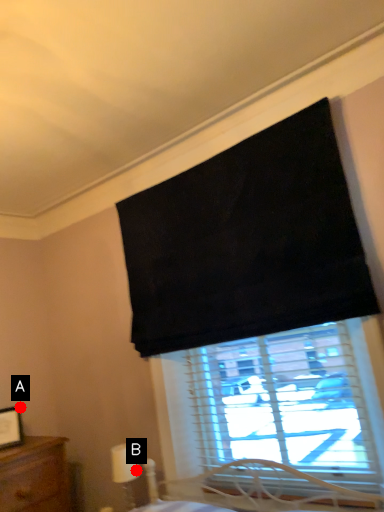
Question: Two points are circled on the image, labeled by A and B beside each circle. Which point is further to the camera?

Choices:
 (A) A is further
 (B) B is further

Answer: (A)